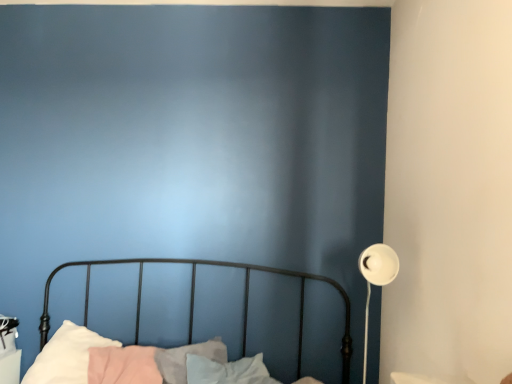
Question: From a real-world perspective, is metallic black bed at lower left positioned above or below white matte floor lamp at right?

Choices:
 (A) below
 (B) above

Answer: (A)

Question: From the image's perspective, relative to white matte floor lamp at right, is metallic black bed at lower left above or below?

Choices:
 (A) below
 (B) above

Answer: (A)

Question: Is metallic black bed at lower left inside the boundaries of white matte floor lamp at right, or outside?

Choices:
 (A) inside
 (B) outside

Answer: (B)

Question: Is white matte floor lamp at right bigger or smaller than metallic black bed at lower left?

Choices:
 (A) small
 (B) big

Answer: (A)

Question: Is white matte floor lamp at right inside or outside of metallic black bed at lower left?

Choices:
 (A) inside
 (B) outside

Answer: (A)

Question: From a real-world perspective, relative to metallic black bed at lower left, is white matte floor lamp at right vertically above or below?

Choices:
 (A) below
 (B) above

Answer: (B)

Question: In terms of height, does white matte floor lamp at right look taller or shorter compared to metallic black bed at lower left?

Choices:
 (A) short
 (B) tall

Answer: (A)